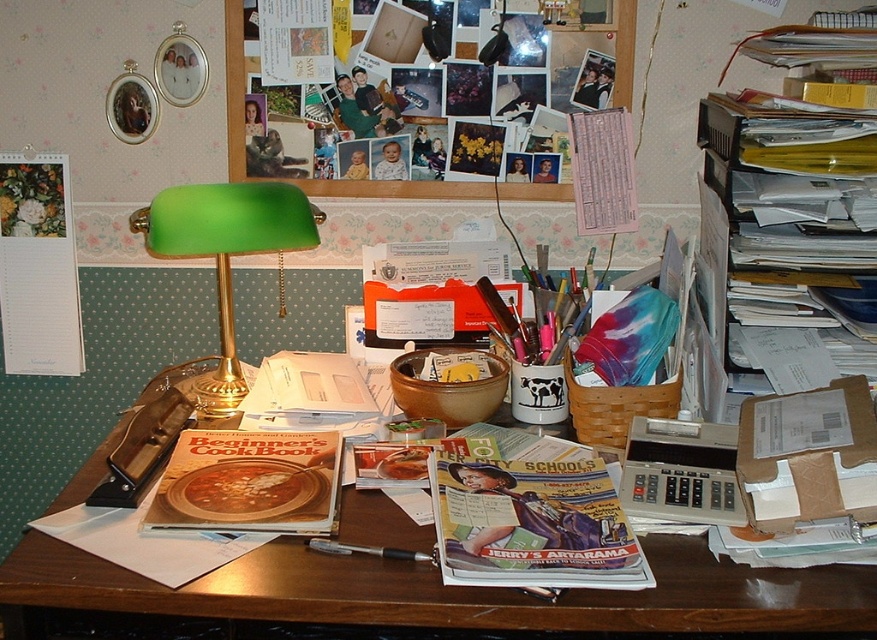
Who is lower down, matte paper magazine at center or metallic pen at center?

Positioned lower is metallic pen at center.

Based on the photo, is matte paper magazine at center shorter than metallic pen at center?

No.

Find the location of a particular element. This screenshot has height=640, width=877. matte paper magazine at center is located at coordinates (533, 522).

I want to click on wooden at center, so click(x=441, y=595).

Between point (497, 588) and point (286, 184), which one is positioned in front?

Point (497, 588) is in front.

Who is more forward, (x=376, y=589) or (x=230, y=211)?

Point (x=376, y=589)

Where is `wooden at center`? wooden at center is located at coordinates (441, 595).

Is wooden at center positioned behind matte paper magazine at center?

That is False.

Can you confirm if wooden at center is positioned to the right of matte paper magazine at center?

Incorrect, wooden at center is not on the right side of matte paper magazine at center.

The height and width of the screenshot is (640, 877). What are the coordinates of `wooden at center` in the screenshot? It's located at (441, 595).